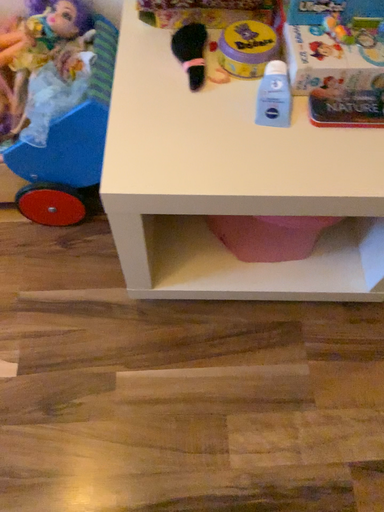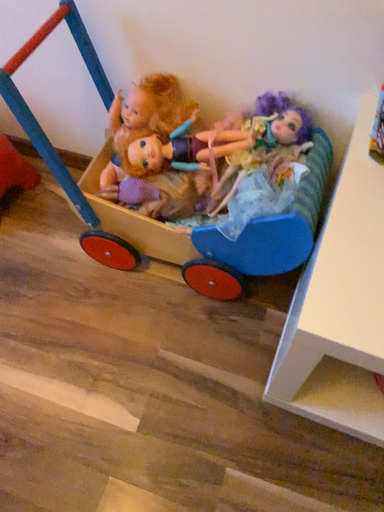
Question: How did the camera likely rotate when shooting the video?

Choices:
 (A) rotated right
 (B) rotated left

Answer: (B)